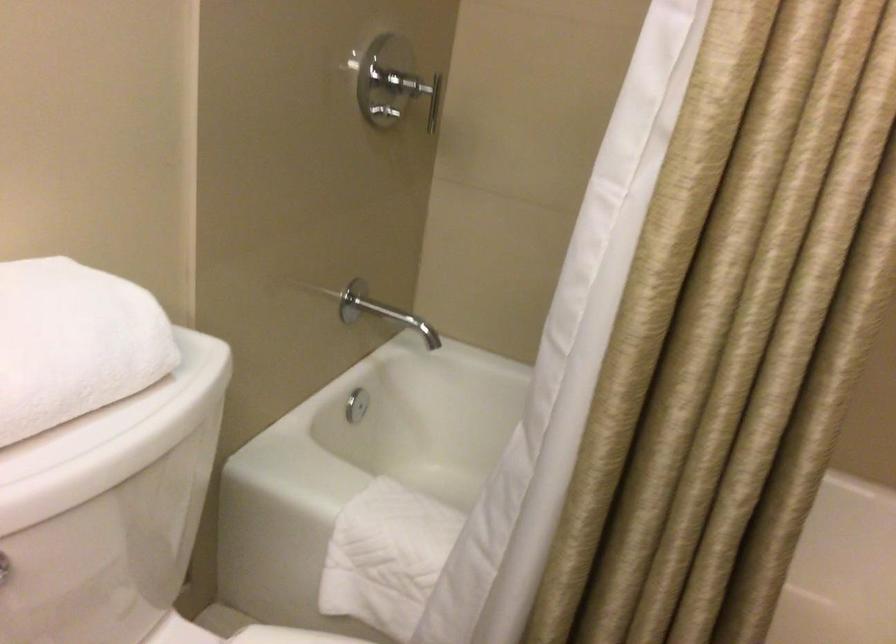
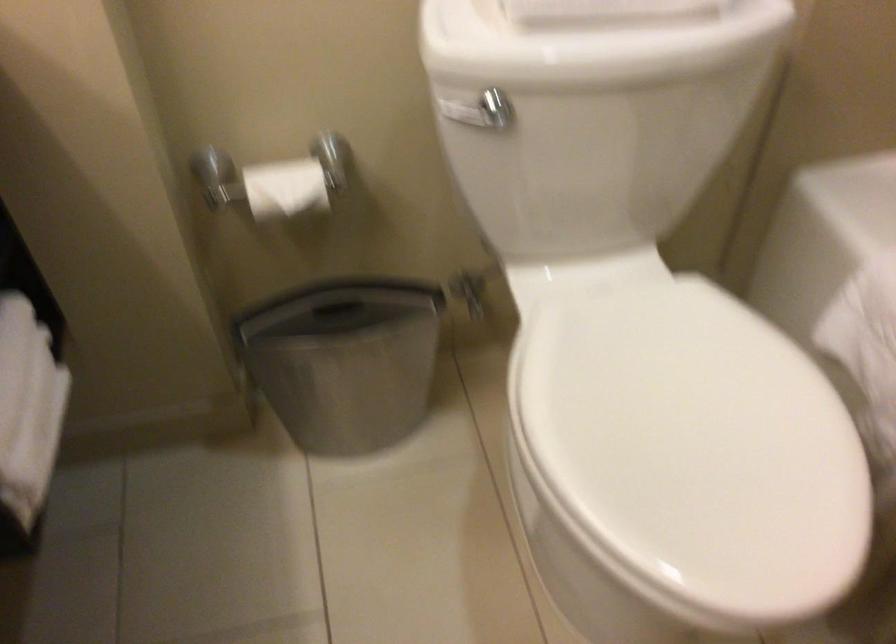
First-person continuous shooting, in which direction is the camera rotating?

The rotation direction of the camera is left-down.